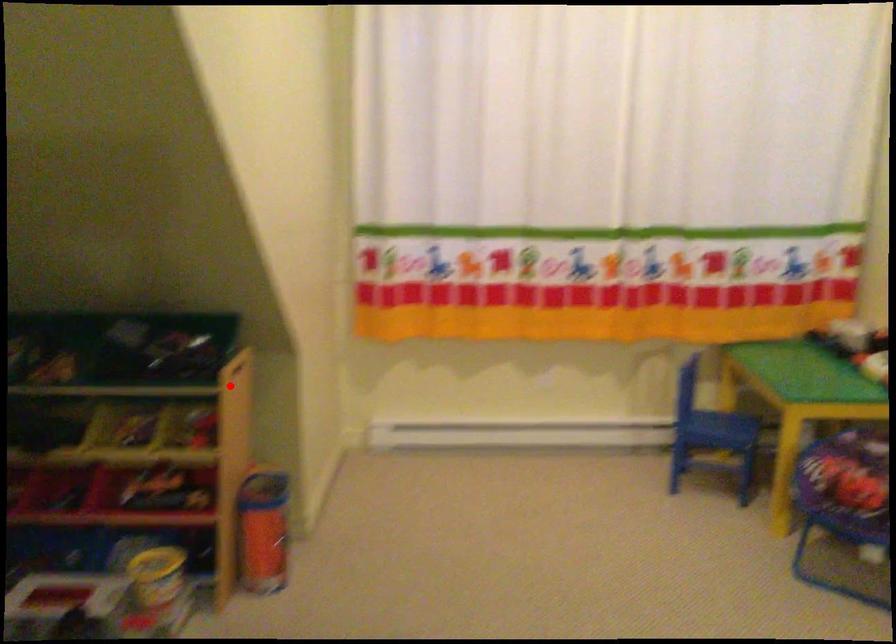
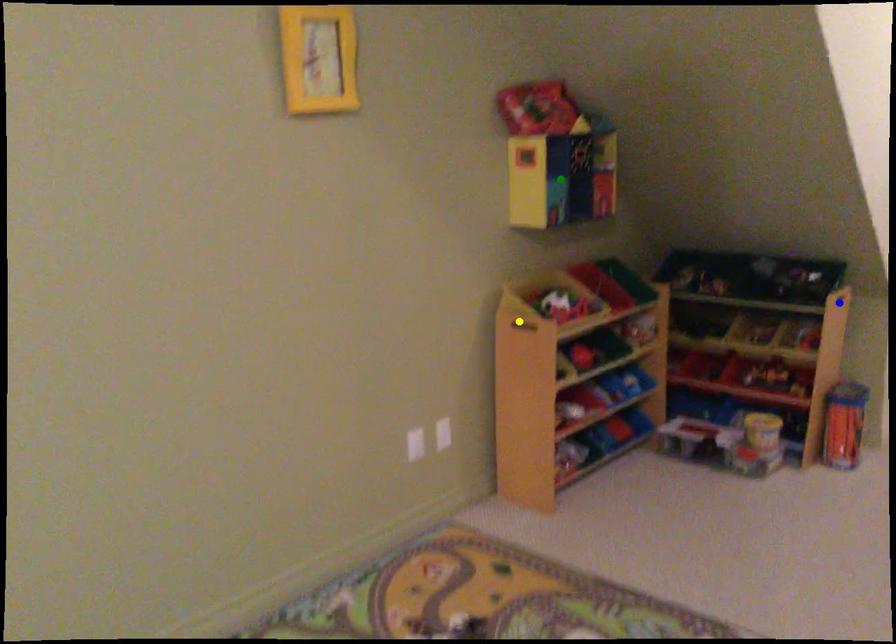
Question: I am providing you with two images of the same scene from different viewpoints. A red point is marked on the first image. You are given multiple points on the second image. Which spot in image 2 lines up with the point in image 1?

Choices:
 (A) blue point
 (B) yellow point
 (C) green point

Answer: (A)